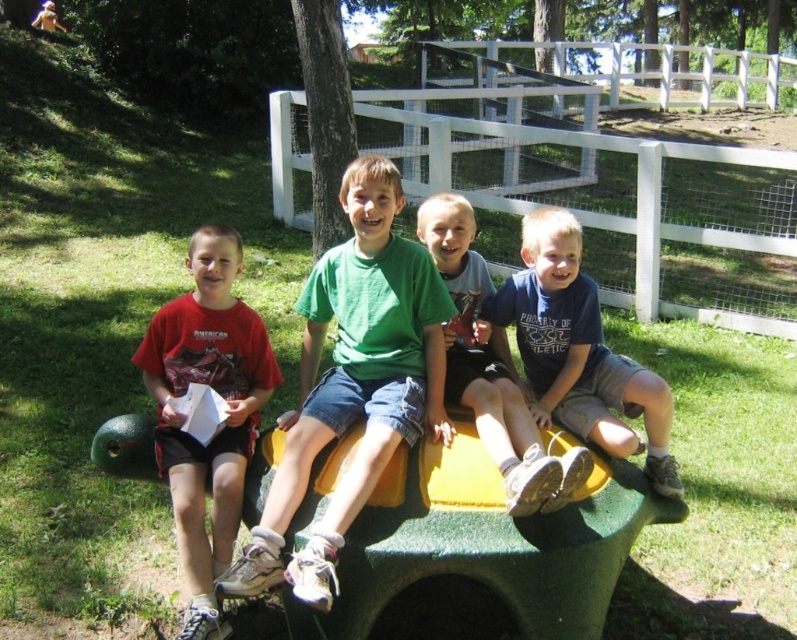
Question: Estimate the real-world distances between objects in this image. Which object is farther from the blue cotton shirt at center?

Choices:
 (A) green cotton shirt at center
 (B) matte red t-shirt at left

Answer: (B)

Question: Can you confirm if green cotton shirt at center is positioned to the left of matte red t-shirt at left?

Choices:
 (A) yes
 (B) no

Answer: (B)

Question: Is matte red t-shirt at left to the right of matte green t-shirt at center from the viewer's perspective?

Choices:
 (A) yes
 (B) no

Answer: (B)

Question: Which object appears farthest from the camera in this image?

Choices:
 (A) matte green t-shirt at center
 (B) matte red t-shirt at left

Answer: (B)

Question: Which object is positioned closest to the blue cotton shirt at center?

Choices:
 (A) matte red t-shirt at left
 (B) matte green t-shirt at center

Answer: (B)

Question: Does matte red t-shirt at left appear under matte green t-shirt at center?

Choices:
 (A) no
 (B) yes

Answer: (B)